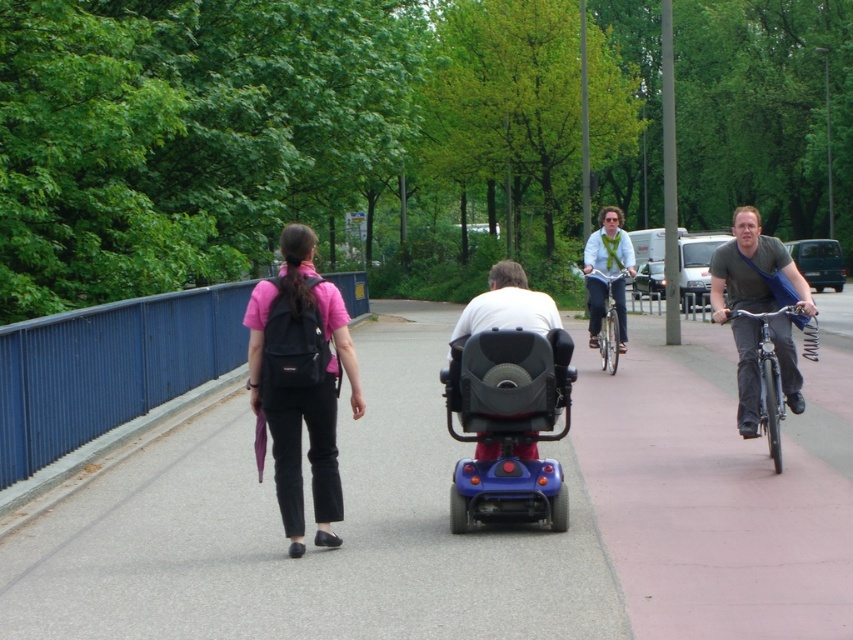
Question: Does gray asphalt at center have a greater width compared to black fabric backpack at left?

Choices:
 (A) no
 (B) yes

Answer: (B)

Question: Which is nearer to the blue plastic mobility scooter at center?

Choices:
 (A) silver metallic bicycle at center
 (B) black fabric backpack at left
 (C) matte black scooter at center

Answer: (C)

Question: Which point appears closest to the camera in this image?

Choices:
 (A) (766, 381)
 (B) (390, 556)
 (C) (498, 320)

Answer: (B)

Question: Which object is closer to the camera taking this photo?

Choices:
 (A) matte black scooter at center
 (B) silver metallic bicycle at center
 (C) shiny silver bicycle at right

Answer: (A)

Question: Is gray asphalt at center wider than silver metallic bicycle at center?

Choices:
 (A) yes
 (B) no

Answer: (A)

Question: Can you confirm if black fabric backpack at left is positioned to the right of blue plastic mobility scooter at center?

Choices:
 (A) yes
 (B) no

Answer: (B)